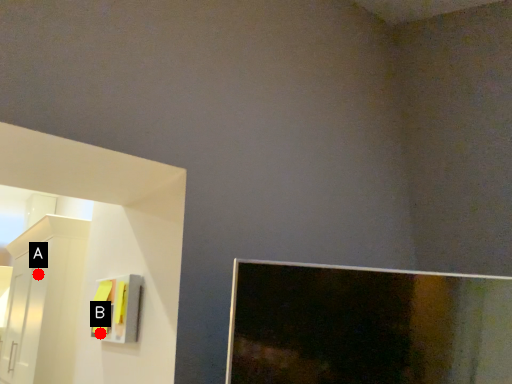
Question: Two points are circled on the image, labeled by A and B beside each circle. Which point is farther from the camera taking this photo?

Choices:
 (A) A is further
 (B) B is further

Answer: (A)